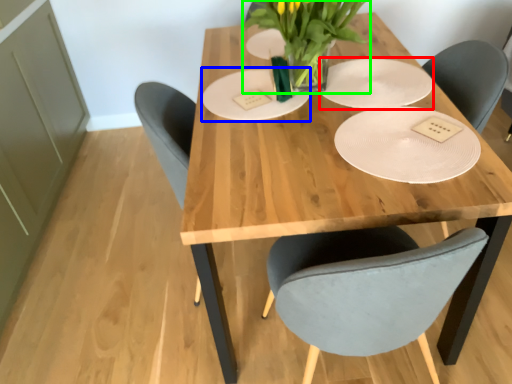
Question: Which object is the closest to the paper plate (highlighted by a red box)? Choose among these: paper plate (highlighted by a blue box) or floral arrangement (highlighted by a green box).

Choices:
 (A) paper plate
 (B) floral arrangement

Answer: (B)